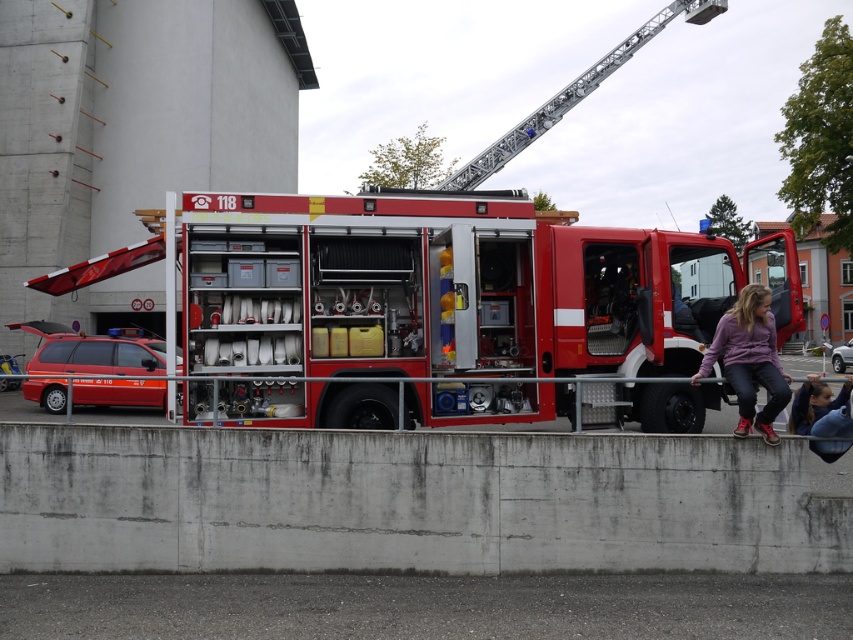
You are standing at the scene and want to take a photo of the metallic red fire truck at center without including the dark blue fabric jacket at lower right in the frame. Is this possible based on their positions?

The metallic red fire truck at center is located below the dark blue fabric jacket at lower right, so if you position yourself lower or adjust your angle to exclude the jacket, you can capture the fire truck without the jacket in the frame.